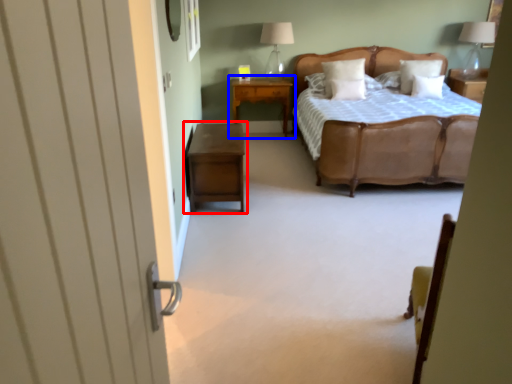
Question: Which object is further to the camera taking this photo, nightstand (highlighted by a red box) or nightstand (highlighted by a blue box)?

Choices:
 (A) nightstand
 (B) nightstand

Answer: (B)